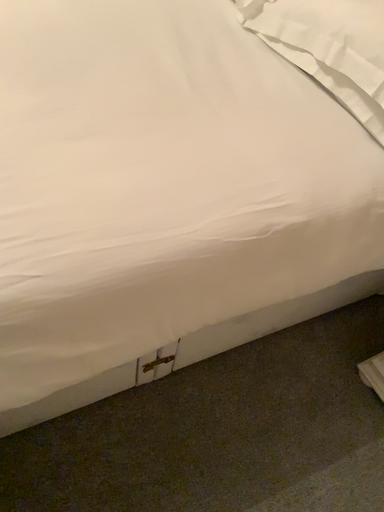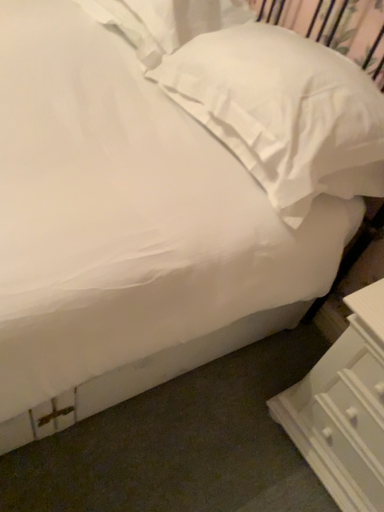
Question: How did the camera likely rotate when shooting the video?

Choices:
 (A) rotated left
 (B) rotated right

Answer: (B)